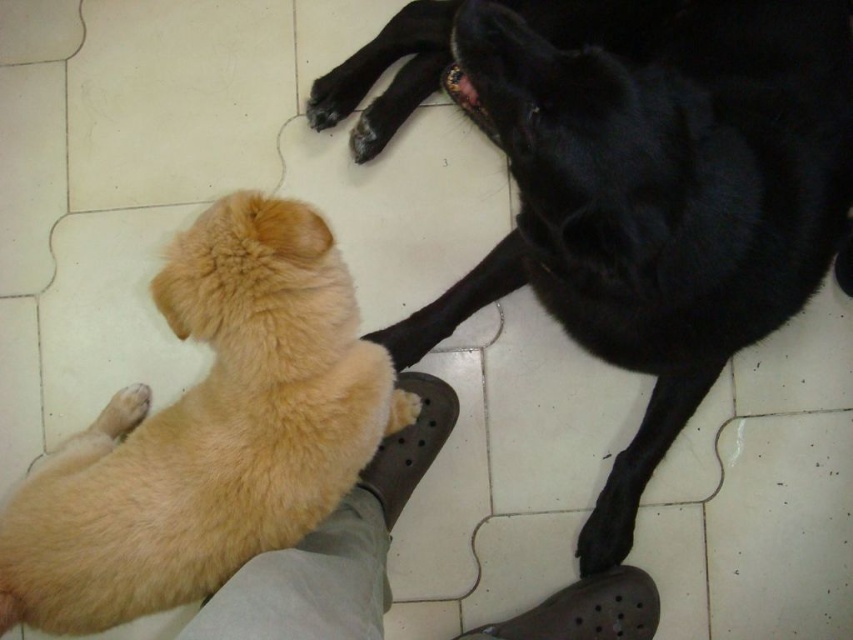
Question: Which point is closer to the camera?

Choices:
 (A) (780, 200)
 (B) (308, 566)

Answer: (B)

Question: In this image, where is shiny black dog at upper right located relative to golden fur dog at lower left?

Choices:
 (A) below
 (B) above

Answer: (B)

Question: Which object is the closest to the beige fabric pants at lower left?

Choices:
 (A) golden fur dog at lower left
 (B) shiny black dog at upper right
 (C) black matte paw at lower center

Answer: (A)

Question: Is golden fur dog at lower left below black matte paw at lower center?

Choices:
 (A) no
 (B) yes

Answer: (A)

Question: Which object appears closest to the camera in this image?

Choices:
 (A) golden fur dog at lower left
 (B) beige fabric pants at lower left
 (C) shiny black dog at upper right

Answer: (B)

Question: Is beige fabric pants at lower left wider than light brown fur at lower left?

Choices:
 (A) yes
 (B) no

Answer: (A)